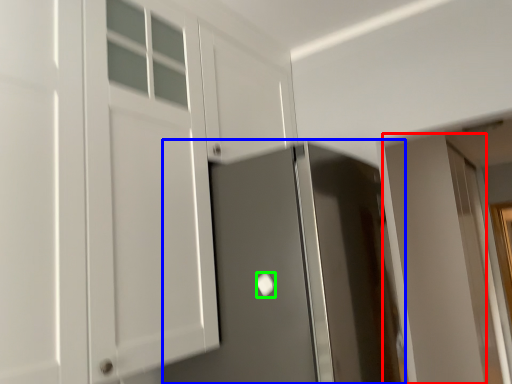
Question: Based on their relative distances, which object is farther from door (highlighted by a red box)? Choose from door (highlighted by a blue box) and door handle (highlighted by a green box).

Choices:
 (A) door
 (B) door handle

Answer: (B)